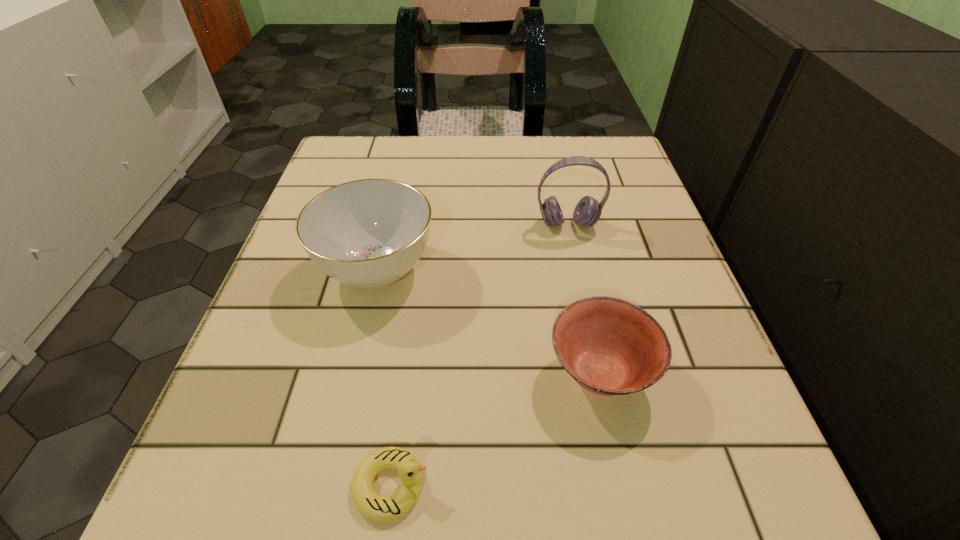
Where is `vacant area that lies between the bowl and the tallest object`? This screenshot has width=960, height=540. vacant area that lies between the bowl and the tallest object is located at coordinates pyautogui.click(x=584, y=299).

Identify which object is the second closest to the shortest object. Please provide its 2D coordinates. Your answer should be formatted as a tuple, i.e. [(x, y)], where the tuple contains the x and y coordinates of a point satisfying the conditions above.

[(369, 233)]

Choose which object is the third nearest neighbor to the tallest object. Please provide its 2D coordinates. Your answer should be formatted as a tuple, i.e. [(x, y)], where the tuple contains the x and y coordinates of a point satisfying the conditions above.

[(367, 501)]